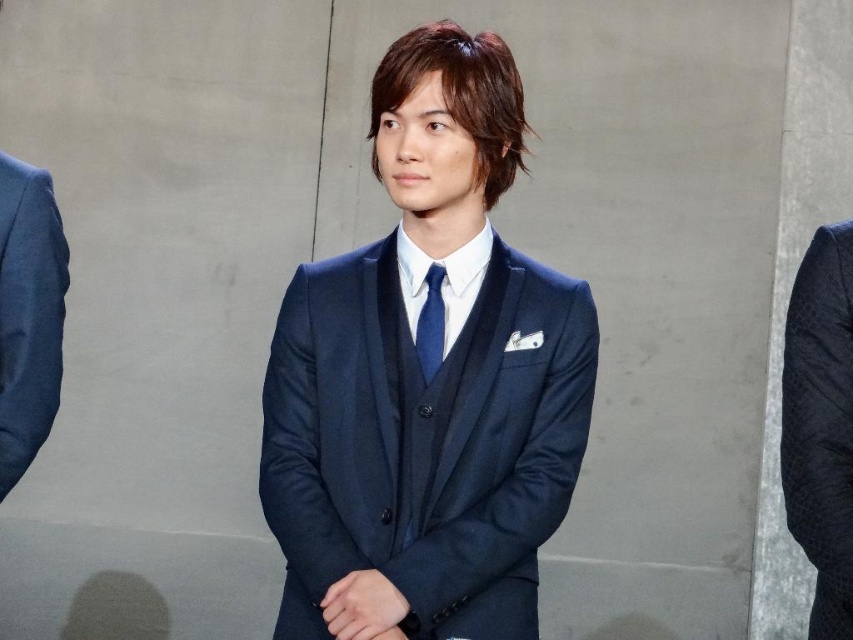
Question: Can you confirm if matte blue suit at left is wider than matte blue tie at center?

Choices:
 (A) no
 (B) yes

Answer: (B)

Question: Can you confirm if navy textured suit at center is positioned to the left of matte blue suit at left?

Choices:
 (A) yes
 (B) no

Answer: (B)

Question: Which of the following is the farthest from the observer?

Choices:
 (A) matte blue suit at left
 (B) matte blue tie at center
 (C) navy textured suit at center
 (D) navy blue suit at center

Answer: (B)

Question: Which point appears closest to the camera in this image?

Choices:
 (A) (310, 560)
 (B) (838, 381)

Answer: (B)

Question: Which point is closer to the camera taking this photo?

Choices:
 (A) (18, 227)
 (B) (432, 300)
 (C) (828, 228)

Answer: (C)

Question: Does matte blue suit at left appear on the right side of matte blue tie at center?

Choices:
 (A) yes
 (B) no

Answer: (B)